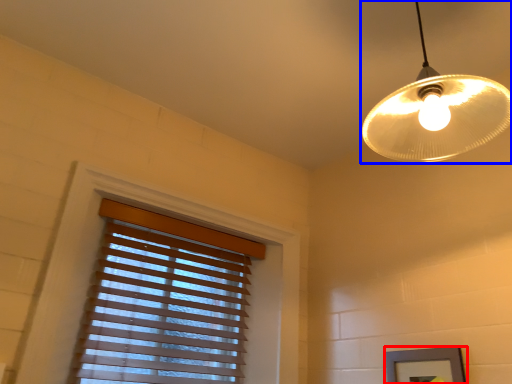
Question: Which object is further to the camera taking this photo, picture frame (highlighted by a red box) or lamp (highlighted by a blue box)?

Choices:
 (A) picture frame
 (B) lamp

Answer: (A)